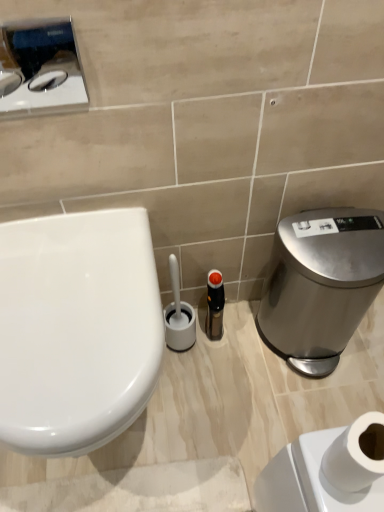
The height and width of the screenshot is (512, 384). In order to click on free space above satin silver trash can at right (from a real-world perspective) in this screenshot , I will do `click(336, 234)`.